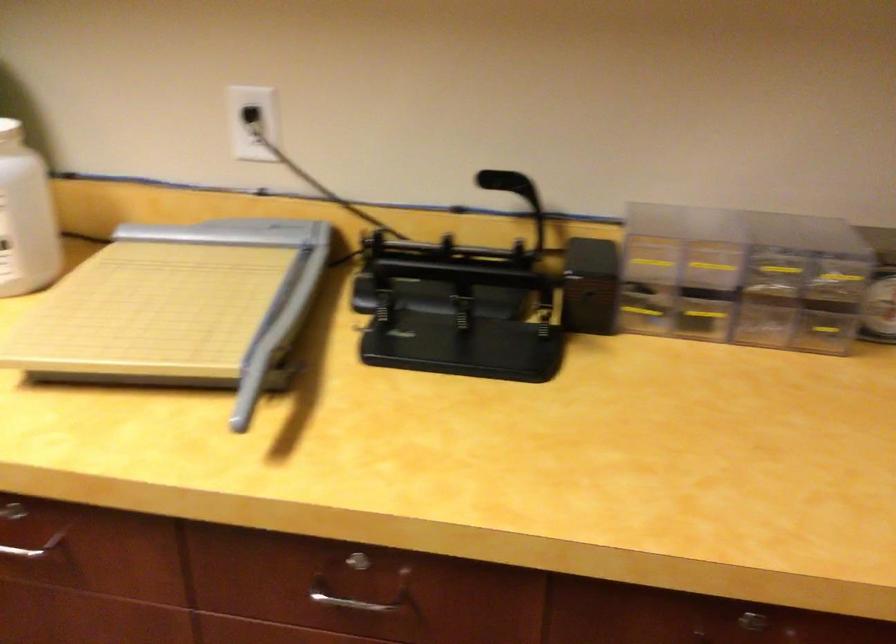
What do you see at coordinates (33, 547) in the screenshot? Image resolution: width=896 pixels, height=644 pixels. I see `the metal drawer handle` at bounding box center [33, 547].